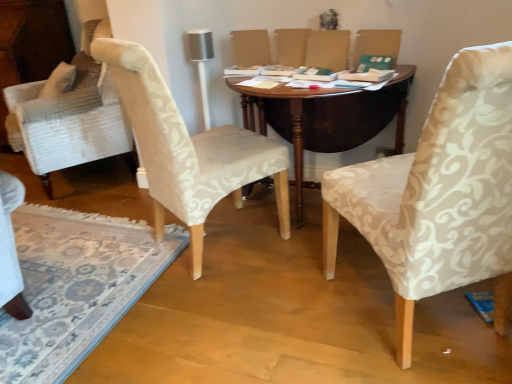
Question: From a real-world perspective, is beige damask chair at right, which is the 2th chair from left to right, below white textured fabric chair at left, which appears as the 2th chair when viewed from the right?

Choices:
 (A) no
 (B) yes

Answer: (A)

Question: From a real-world perspective, does beige damask chair at right, which is the 2th chair from left to right, stand above white textured fabric chair at left, the 1th chair viewed from the left?

Choices:
 (A) no
 (B) yes

Answer: (B)

Question: Is the depth of beige damask chair at right, which is the 2th chair from left to right, less than that of white textured fabric chair at left, which appears as the 2th chair when viewed from the right?

Choices:
 (A) no
 (B) yes

Answer: (B)

Question: Is beige damask chair at right, which ranks as the first chair in right-to-left order, aimed at white textured fabric chair at left, which appears as the 2th chair when viewed from the right?

Choices:
 (A) yes
 (B) no

Answer: (B)

Question: Can you confirm if beige damask chair at right, which is the 2th chair from left to right, is bigger than white textured fabric chair at left, which appears as the 2th chair when viewed from the right?

Choices:
 (A) no
 (B) yes

Answer: (B)

Question: Is beige damask chair at right, which ranks as the first chair in right-to-left order, to the left of white textured fabric chair at left, which appears as the 2th chair when viewed from the right, from the viewer's perspective?

Choices:
 (A) yes
 (B) no

Answer: (B)

Question: From the image's perspective, is white textured fabric chair at left, the 1th chair viewed from the left, below beige damask chair at right, which is the 2th chair from left to right?

Choices:
 (A) no
 (B) yes

Answer: (A)

Question: From a real-world perspective, is white textured fabric chair at left, the 1th chair viewed from the left, located beneath beige damask chair at right, which ranks as the first chair in right-to-left order?

Choices:
 (A) yes
 (B) no

Answer: (A)

Question: Is white textured fabric chair at left, which appears as the 2th chair when viewed from the right, positioned with its back to beige damask chair at right, which is the 2th chair from left to right?

Choices:
 (A) yes
 (B) no

Answer: (B)

Question: Could beige damask chair at right, which is the 2th chair from left to right, be considered to be inside white textured fabric chair at left, the 1th chair viewed from the left?

Choices:
 (A) yes
 (B) no

Answer: (B)

Question: Could you tell me if white textured fabric chair at left, which appears as the 2th chair when viewed from the right, is facing beige damask chair at right, which ranks as the first chair in right-to-left order?

Choices:
 (A) no
 (B) yes

Answer: (A)

Question: Considering the relative sizes of white textured fabric chair at left, the 1th chair viewed from the left, and beige damask chair at right, which ranks as the first chair in right-to-left order, in the image provided, is white textured fabric chair at left, the 1th chair viewed from the left, bigger than beige damask chair at right, which ranks as the first chair in right-to-left order,?

Choices:
 (A) no
 (B) yes

Answer: (A)

Question: Is white textured fabric chair at left, which appears as the 2th chair when viewed from the right, not inside dark wood table at center?

Choices:
 (A) no
 (B) yes

Answer: (B)